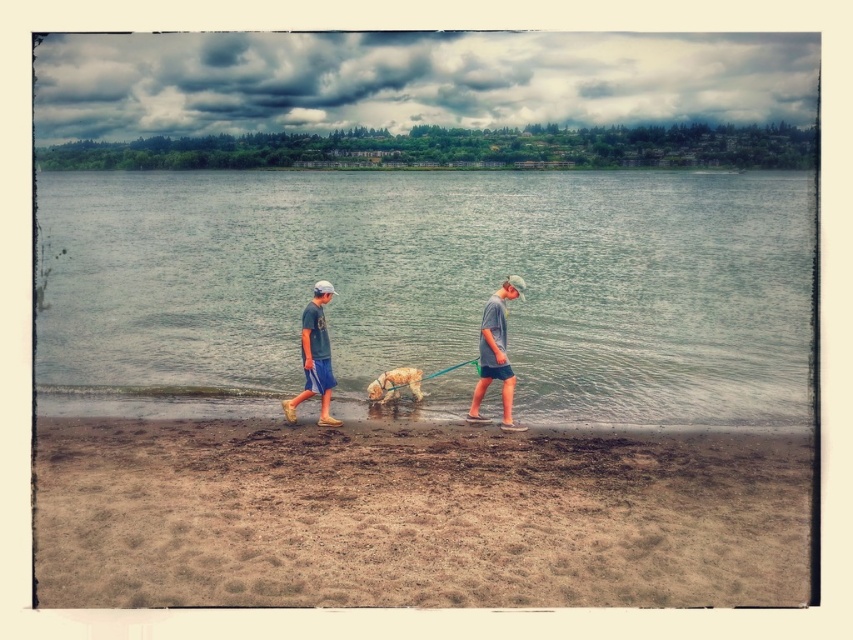
Between clear water at center and matte blue shorts at center, which one has less height?

matte blue shorts at center

This screenshot has width=853, height=640. I want to click on clear water at center, so click(436, 285).

Locate an element on the screen. This screenshot has height=640, width=853. clear water at center is located at coordinates (436, 285).

Identify the location of clear water at center. The image size is (853, 640). (436, 285).

Does clear water at center appear over golden fur dog at center?

Indeed, clear water at center is positioned over golden fur dog at center.

The image size is (853, 640). Identify the location of clear water at center. (436, 285).

Can you confirm if brown sandy beach at lower center is positioned to the right of matte blue shorts at center?

Yes, brown sandy beach at lower center is to the right of matte blue shorts at center.

Is brown sandy beach at lower center in front of matte blue shorts at center?

That is True.

Is point (344, 515) less distant than point (315, 321)?

Yes, it is in front of point (315, 321).

The image size is (853, 640). I want to click on brown sandy beach at lower center, so click(x=415, y=515).